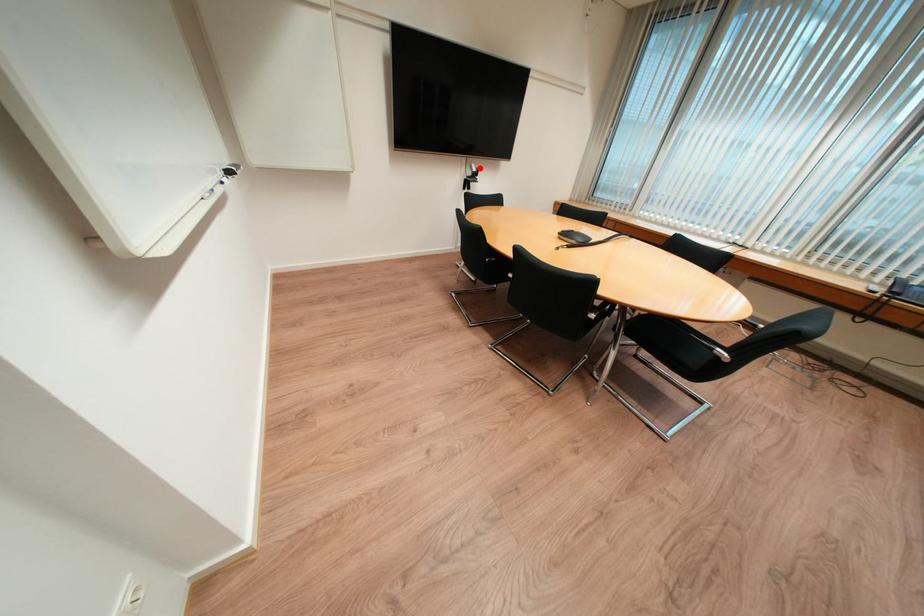
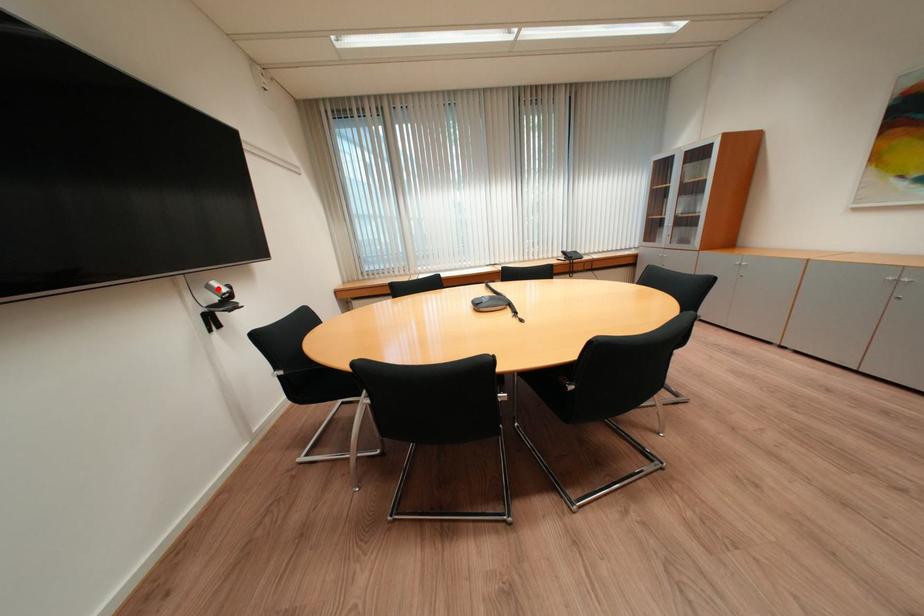
Looking at this image, I am providing you with two images of the same scene from different viewpoints. A red point is marked on the first image and another point is marked on the second image. Is the red point in image1 aligned with the point shown in image2?

Yes